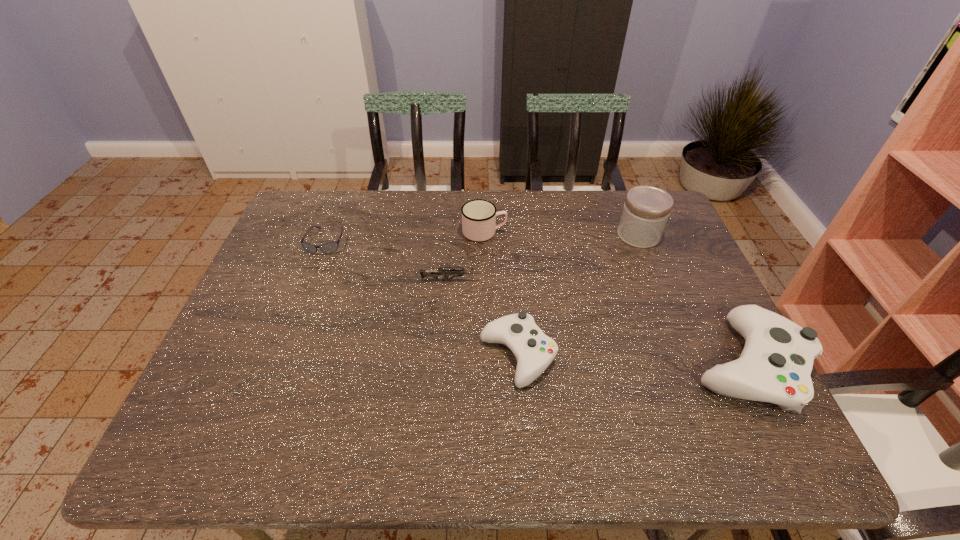
The height and width of the screenshot is (540, 960). In order to click on vacant space situated 0.090m on the left of the right control in this screenshot , I will do `click(652, 364)`.

The width and height of the screenshot is (960, 540). In order to click on free space located 0.260m on the side of the mug with the handle in this screenshot , I will do `click(589, 232)`.

The width and height of the screenshot is (960, 540). I want to click on free space located on the front of the jar, so click(661, 293).

This screenshot has width=960, height=540. In order to click on vacant space located on the lenses of the shortest object in this screenshot , I will do `click(314, 272)`.

Find the location of a particular element. This screenshot has height=540, width=960. free region located 0.200m aimed along the barrel of the third nearest object is located at coordinates (553, 280).

Locate an element on the screen. mug located in the far edge section of the desktop is located at coordinates (478, 216).

I want to click on jar that is at the far edge, so click(x=646, y=210).

At what (x,y) coordinates should I click in order to perform the action: click on sunglasses that is at the far edge. Please return your answer as a coordinate pair (x, y). This screenshot has height=540, width=960. Looking at the image, I should click on (327, 248).

The height and width of the screenshot is (540, 960). Identify the location of object that is at the left edge. (327, 248).

This screenshot has width=960, height=540. What are the coordinates of `control that is positioned at the right edge` in the screenshot? It's located at (775, 365).